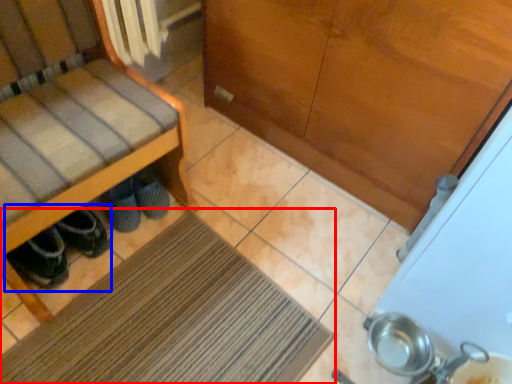
Question: Which point is closer to the camera, mat (highlighted by a red box) or footwear (highlighted by a blue box)?

Choices:
 (A) mat
 (B) footwear

Answer: (A)